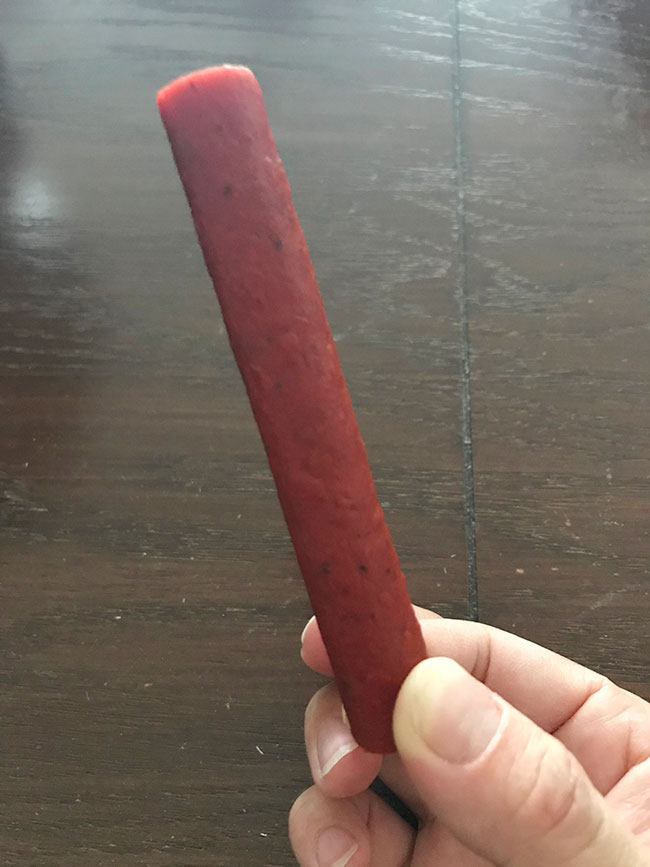
Locate an element on the screen. The width and height of the screenshot is (650, 867). floor is located at coordinates (127, 570).